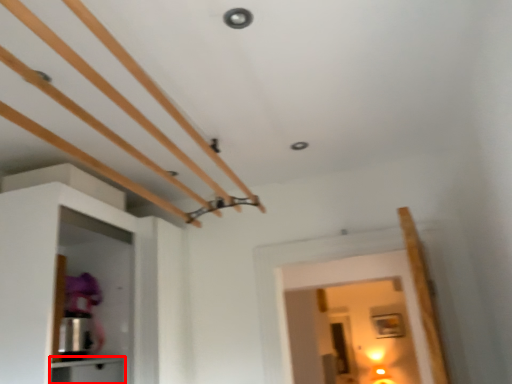
Question: Where is cabinetry (annotated by the red box) located in relation to cabinetry in the image?

Choices:
 (A) right
 (B) left

Answer: (A)